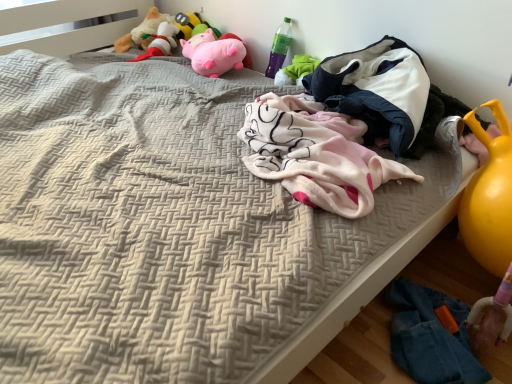
Question: Based on their positions, is green plastic bottle at upper right located to the left or right of pink plush pig at upper center, the first toy in the right-to-left sequence?

Choices:
 (A) right
 (B) left

Answer: (A)

Question: Looking at the image, does green plastic bottle at upper right seem bigger or smaller compared to pink plush pig at upper center, which is counted as the 4th toy, starting from the left?

Choices:
 (A) big
 (B) small

Answer: (B)

Question: Which object is the closest to the pink plush toy at upper center, the third toy from the left?

Choices:
 (A) pink plush pig at upper center, the first toy in the right-to-left sequence
 (B) fluffy beige stuffed animal at upper left, which is counted as the fourth toy, starting from the right
 (C) denim jeans at lower right
 (D) white soft blanket at upper right
 (E) fluffy plush toy at upper left, marked as the 2th toy in a left-to-right arrangement

Answer: (E)

Question: Which object is positioned farthest from the white soft blanket at upper right?

Choices:
 (A) fluffy beige stuffed animal at upper left, which is counted as the fourth toy, starting from the right
 (B) pink plush pig at upper center, the first toy in the right-to-left sequence
 (C) denim jeans at lower right
 (D) fluffy plush toy at upper left, positioned as the 3th toy in right-to-left order
 (E) pink plush toy at upper center, the third toy from the left

Answer: (A)